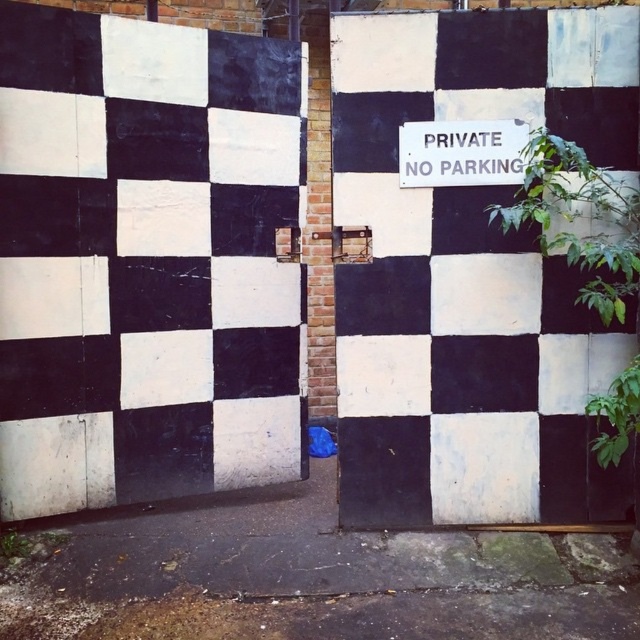
You are a delivery person with a 30 cm wide box. You need to pass through the black painted wood door at center while holding the box. Is there enough space between the door and the white plastic sign at upper center to maneuver safely?

The distance between the black painted wood door at center and the white plastic sign at upper center is 28.86 centimeters. Since the box is 30 cm wide, it is slightly wider than the available space. You may need to adjust your position or tilt the box to fit through the narrow gap safely.

You are standing in front of the wall with the checkerboard pattern and the NO PARKING sign. There are two points marked on the wall at coordinates point (x=604, y=355) and point (x=522, y=173). Which point is closer to you?

Point (x=604, y=355) is further to the viewer than point (x=522, y=173), so the point closer to you is point (x=522, y=173).

Consider the image. You are a delivery person arriving at the building and see the black painted wood door at center and the white plastic sign at upper center. Which object is located to the right of the other?

The black painted wood door at center is positioned on the right side of white plastic sign at upper center, so the door is to the right of the sign.